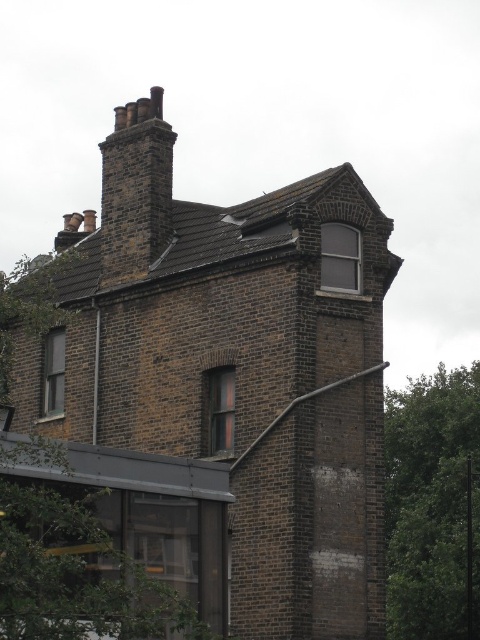
Question: Can you confirm if brown brick chimney at upper center is smaller than green leafy tree at left?

Choices:
 (A) no
 (B) yes

Answer: (A)

Question: Is brown brick chimney at upper center to the right of dark brown brick chimney at upper center from the viewer's perspective?

Choices:
 (A) yes
 (B) no

Answer: (A)

Question: Which object is farther from the camera taking this photo?

Choices:
 (A) brown brick chimney at upper center
 (B) green leafy tree at right
 (C) dark brown brick chimney at upper center

Answer: (B)

Question: Among these objects, which one is nearest to the camera?

Choices:
 (A) green leafy tree at left
 (B) dark brown brick chimney at upper center
 (C) green leafy tree at right

Answer: (A)

Question: Which of the following is the closest to the observer?

Choices:
 (A) green leafy tree at right
 (B) dark brown brick chimney at upper center
 (C) green leafy tree at left
 (D) brown brick chimney at upper center

Answer: (C)

Question: Can you confirm if green leafy tree at right is wider than dark brown brick chimney at upper center?

Choices:
 (A) yes
 (B) no

Answer: (A)